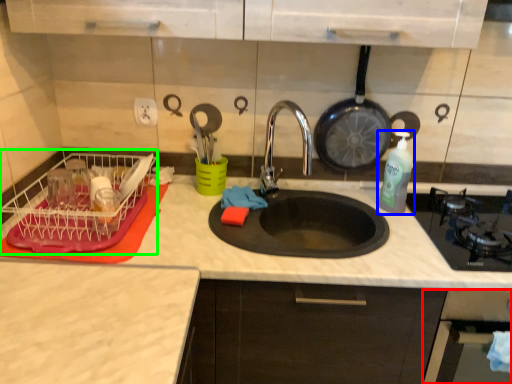
Question: Based on their relative distances, which object is nearer to oven (highlighted by a red box)? Choose from bottle (highlighted by a blue box) and dish washer (highlighted by a green box).

Choices:
 (A) bottle
 (B) dish washer

Answer: (A)